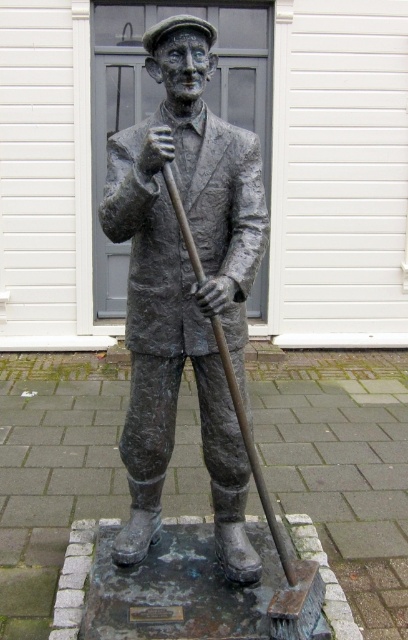
Question: Which point appears closest to the camera in this image?

Choices:
 (A) (316, 625)
 (B) (203, 316)

Answer: (A)

Question: Among these objects, which one is nearest to the camera?

Choices:
 (A) shiny metal shovel at center
 (B) bronze statue at center

Answer: (B)

Question: Considering the relative positions of bronze statue at center and shiny metal shovel at center in the image provided, where is bronze statue at center located with respect to shiny metal shovel at center?

Choices:
 (A) right
 (B) left

Answer: (B)

Question: Does bronze statue at center appear under shiny metal shovel at center?

Choices:
 (A) yes
 (B) no

Answer: (B)

Question: Can you confirm if bronze statue at center is smaller than shiny metal shovel at center?

Choices:
 (A) no
 (B) yes

Answer: (A)

Question: Which of the following is the farthest from the observer?

Choices:
 (A) (190, 275)
 (B) (219, 337)

Answer: (A)